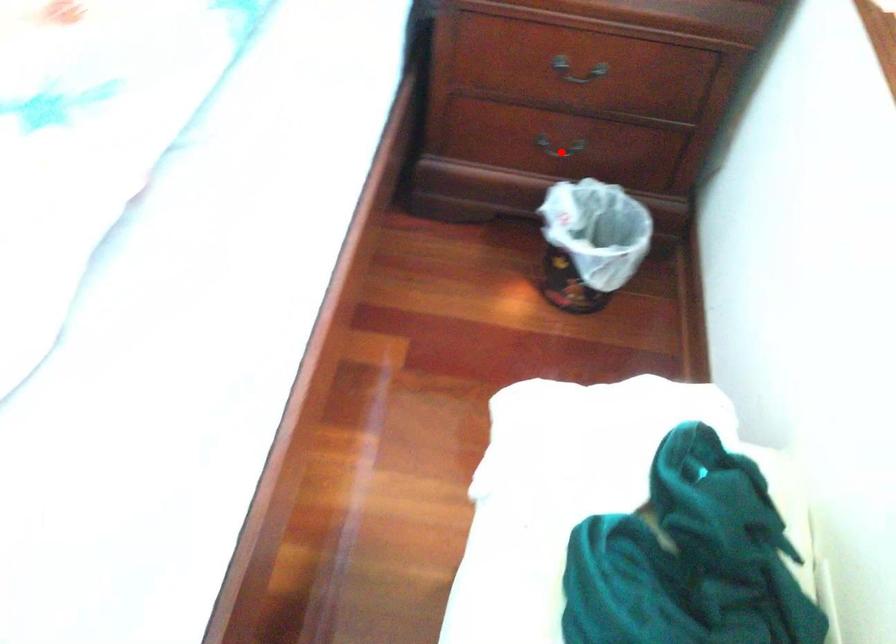
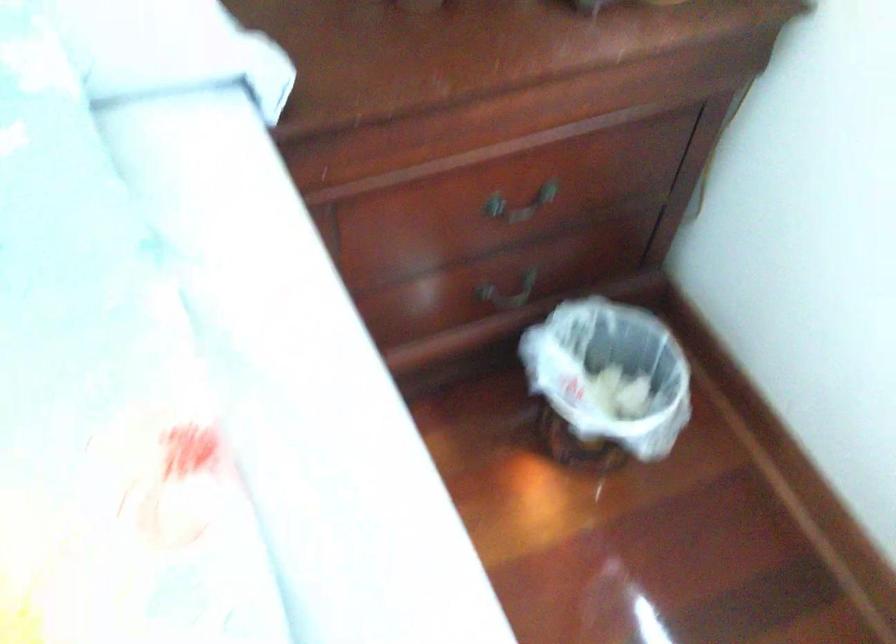
In the second image, find the point that corresponds to the highlighted location in the first image.

(509, 292)